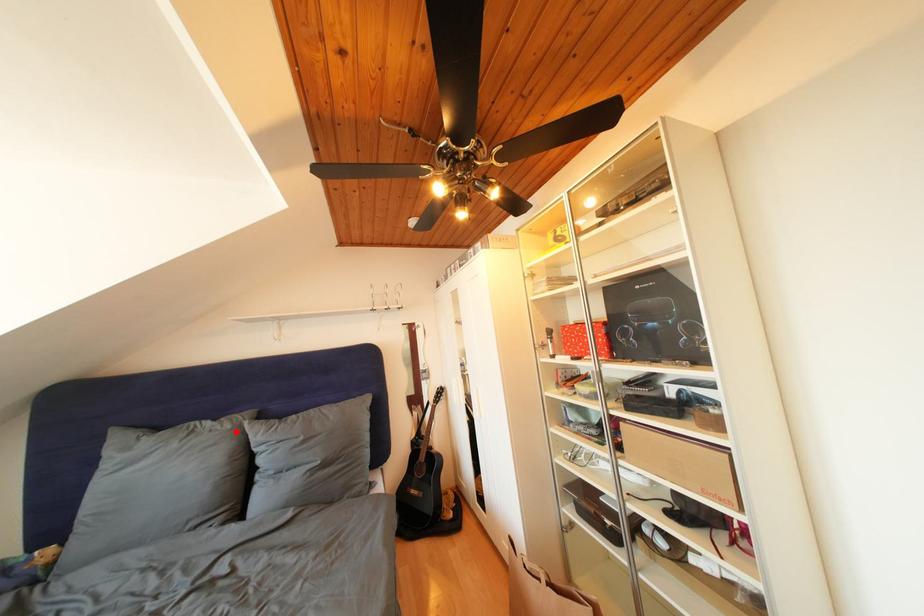
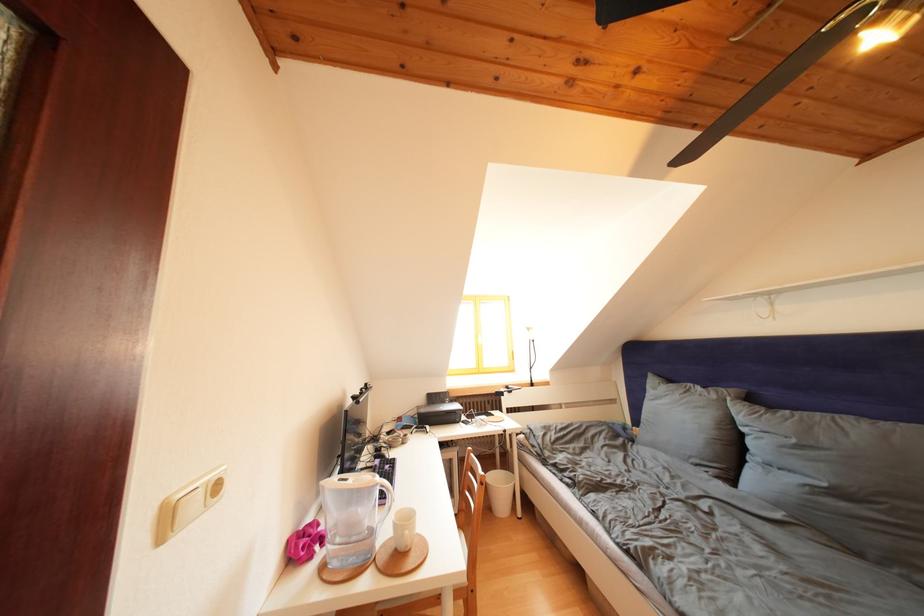
The point at the highlighted location is marked in the first image. Where is the corresponding point in the second image?

(722, 402)